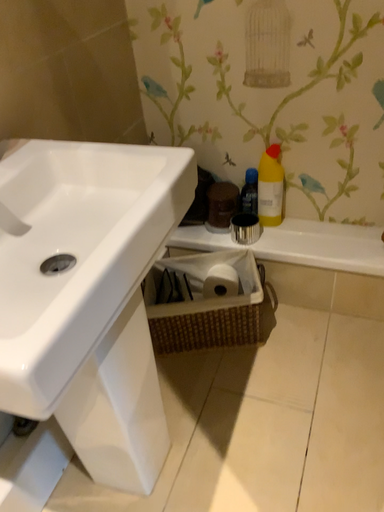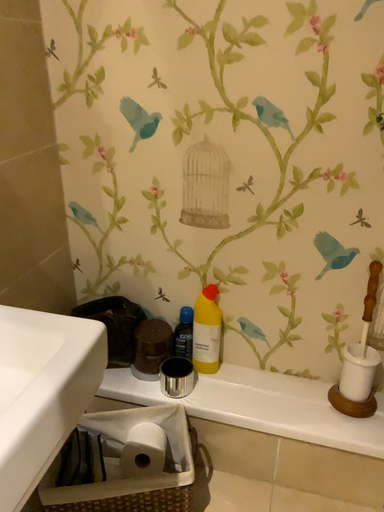
Question: How did the camera likely rotate when shooting the video?

Choices:
 (A) rotated upward
 (B) rotated downward

Answer: (A)